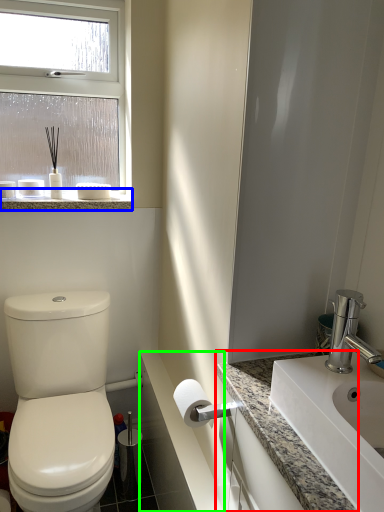
Question: Estimate the real-world distances between objects in this image. Which object is farther from counter top (highlighted by a red box), window sill (highlighted by a blue box) or counter top (highlighted by a green box)?

Choices:
 (A) window sill
 (B) counter top

Answer: (A)